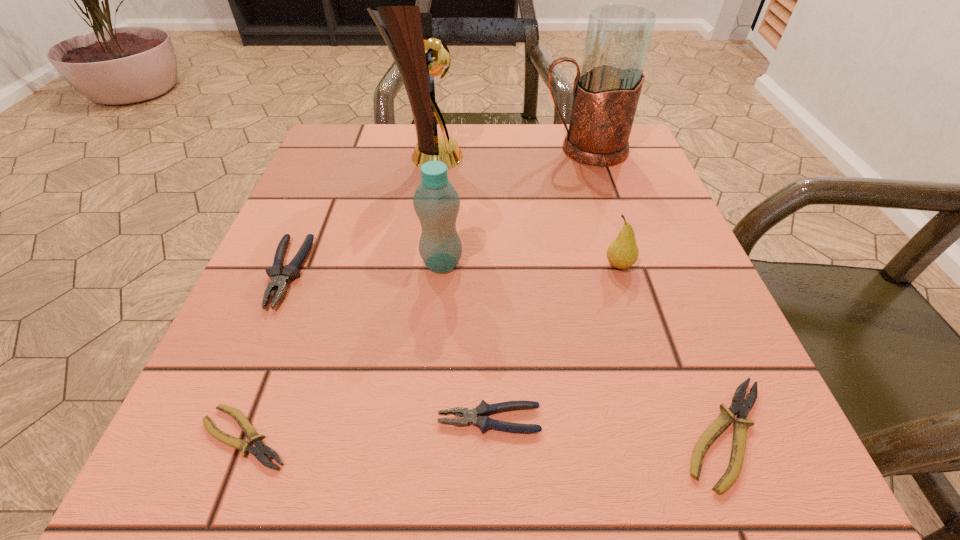
You are a GUI agent. You are given a task and a screenshot of the screen. Output one action in this format:
    pyautogui.click(x=<x>, y=<y>)
    Task: Click on the award
    
    Given the screenshot: What is the action you would take?
    pyautogui.click(x=419, y=56)

Find the location of a particular element. pitcher is located at coordinates (606, 91).

Find the location of `the second tallest object`. the second tallest object is located at coordinates (606, 91).

You are a GUI agent. You are given a task and a screenshot of the screen. Output one action in this format:
    pyautogui.click(x=<x>, y=<y>)
    Task: Click on the water bottle
    
    Given the screenshot: What is the action you would take?
    pyautogui.click(x=436, y=202)

Locate an element on the screen. The height and width of the screenshot is (540, 960). the fourth tallest object is located at coordinates (622, 253).

Where is `the farthest pliers`? the farthest pliers is located at coordinates 279,277.

Where is `the tallest pliers`? This screenshot has width=960, height=540. the tallest pliers is located at coordinates [x=279, y=277].

This screenshot has width=960, height=540. I want to click on the sixth tallest object, so click(483, 410).

Locate an element on the screen. the second pliers from right to left is located at coordinates (483, 410).

Locate an element on the screen. the rightmost pliers is located at coordinates (739, 405).